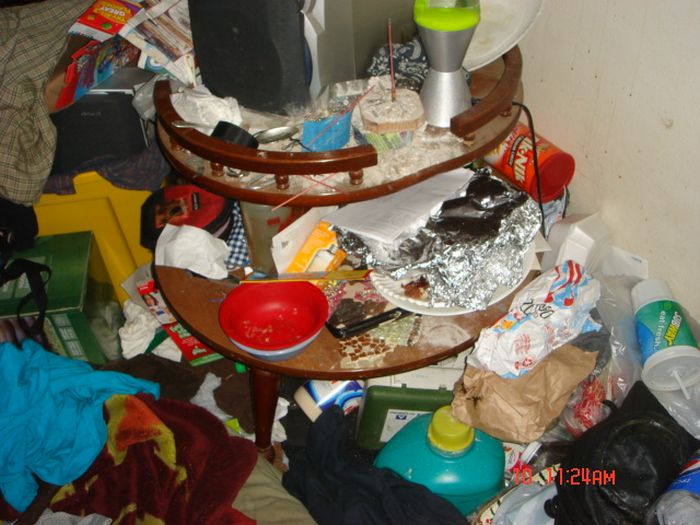
The height and width of the screenshot is (525, 700). What are the coordinates of `laval lamp` in the screenshot? It's located at (440, 50).